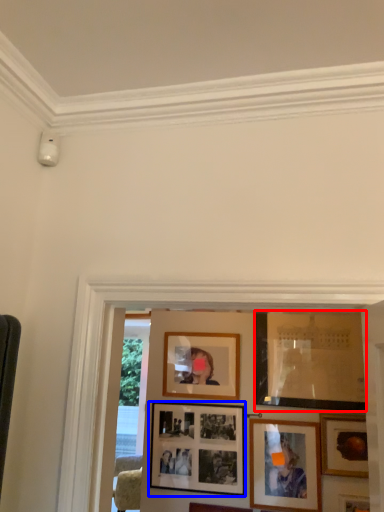
Question: Which point is closer to the camera, picture frame (highlighted by a red box) or picture frame (highlighted by a blue box)?

Choices:
 (A) picture frame
 (B) picture frame

Answer: (A)